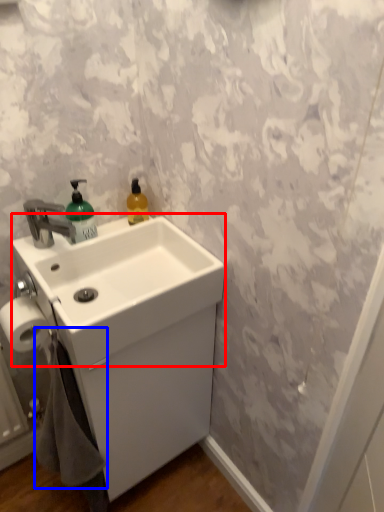
Question: Among these objects, which one is farthest to the camera, counter top (highlighted by a red box) or bath towel (highlighted by a blue box)?

Choices:
 (A) counter top
 (B) bath towel

Answer: (B)